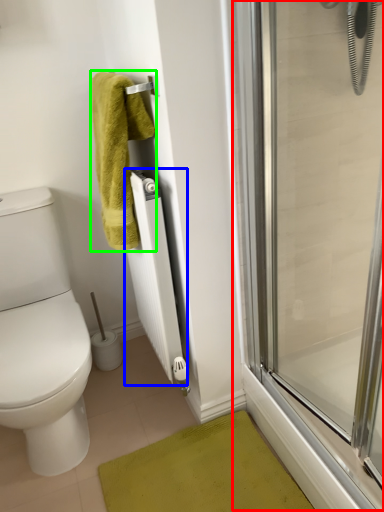
Question: Estimate the real-world distances between objects in this image. Which object is closer to screen door (highlighted by a red box), radiator (highlighted by a blue box) or towel (highlighted by a green box)?

Choices:
 (A) radiator
 (B) towel

Answer: (A)